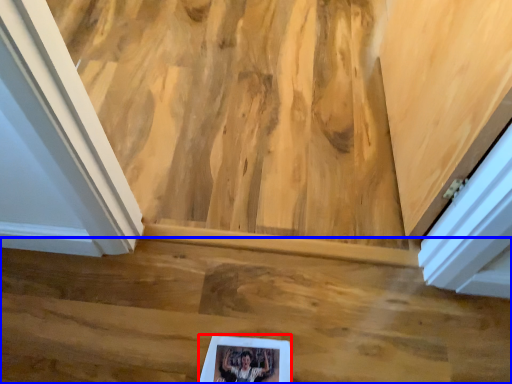
Question: Which of the following is the closest to the observer, picture frame (highlighted by a red box) or stairwell (highlighted by a blue box)?

Choices:
 (A) picture frame
 (B) stairwell

Answer: (A)